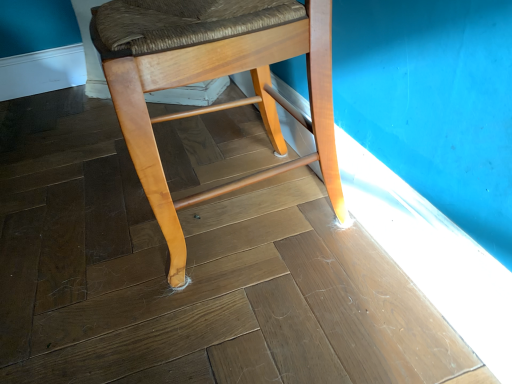
Where is `matte wood stool at center`? matte wood stool at center is located at coordinates (215, 77).

Describe the element at coordinates (215, 77) in the screenshot. Image resolution: width=512 pixels, height=384 pixels. I see `matte wood stool at center` at that location.

Locate an element on the screen. matte wood stool at center is located at coordinates (215, 77).